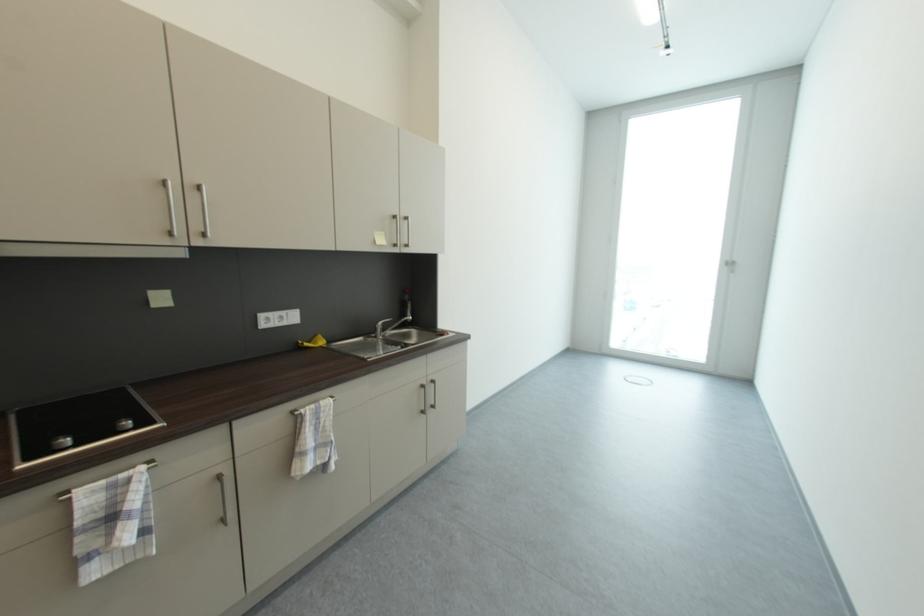
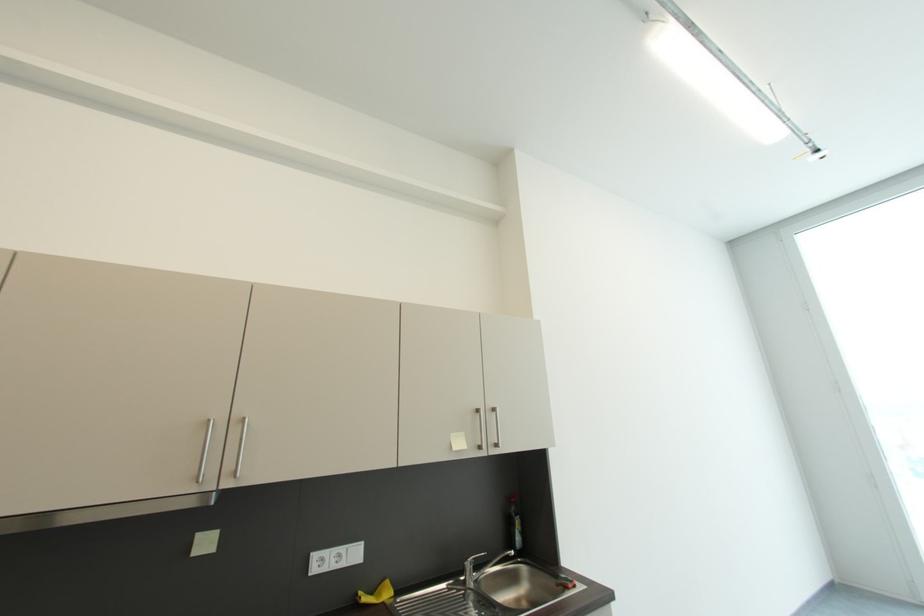
The first image is from the beginning of the video and the second image is from the end. How did the camera likely rotate when shooting the video?

The camera rotated toward left-up.